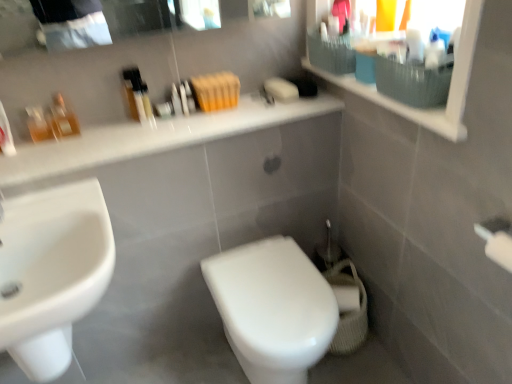
Find the location of a particular element. vacant space that's between translucent glass bottles at left, which is counted as the first toiletry, starting from the left, and translucent plastic bottles at upper center, the 3th toiletry in the left-to-right sequence is located at coordinates (110, 128).